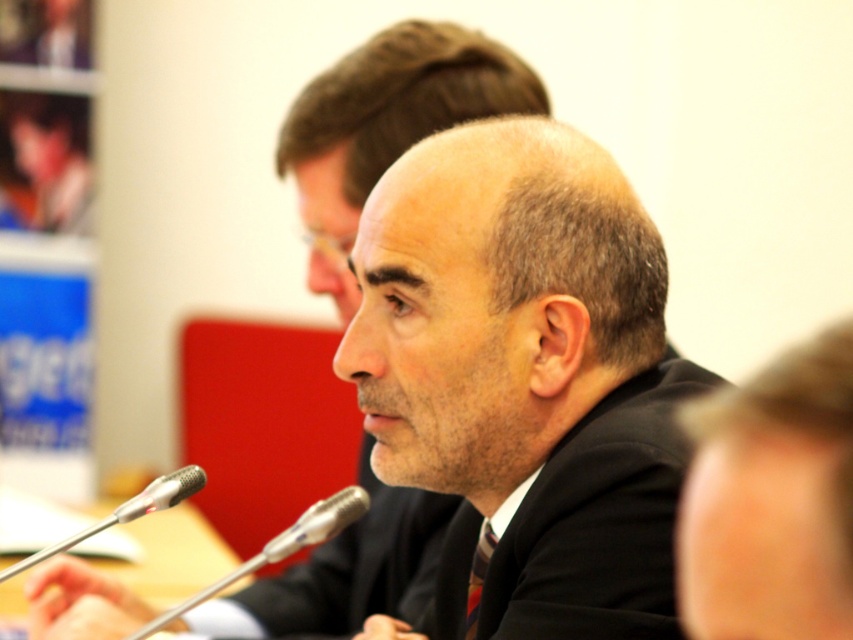
Question: Where is smooth black suit at center located in relation to wooden table at lower left in the image?

Choices:
 (A) below
 (B) above

Answer: (B)

Question: Can you confirm if smooth black suit at center is thinner than wooden table at lower left?

Choices:
 (A) yes
 (B) no

Answer: (A)

Question: Which object is positioned closest to the wooden table at lower left?

Choices:
 (A) smooth black suit at center
 (B) dark suit at center
 (C) silver metallic microphone at lower center

Answer: (C)

Question: Which object appears closest to the camera in this image?

Choices:
 (A) silver metallic microphone at lower center
 (B) wooden table at lower left
 (C) dark suit at center

Answer: (C)

Question: Which point is closer to the camera?

Choices:
 (A) (61, 593)
 (B) (550, 154)
 (C) (306, 529)
 (D) (811, 573)

Answer: (D)

Question: Is wooden table at lower left above silver metallic microphone at lower center?

Choices:
 (A) yes
 (B) no

Answer: (B)